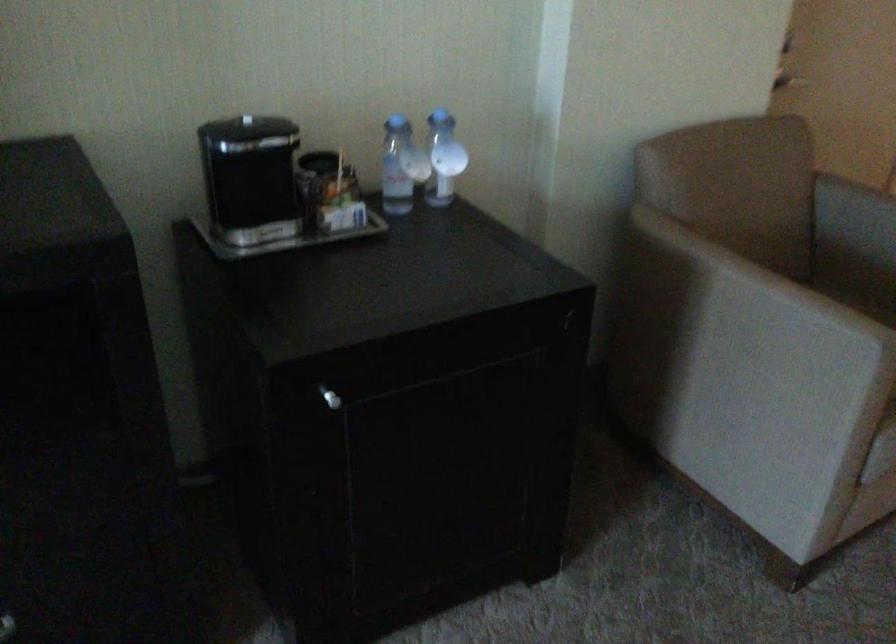
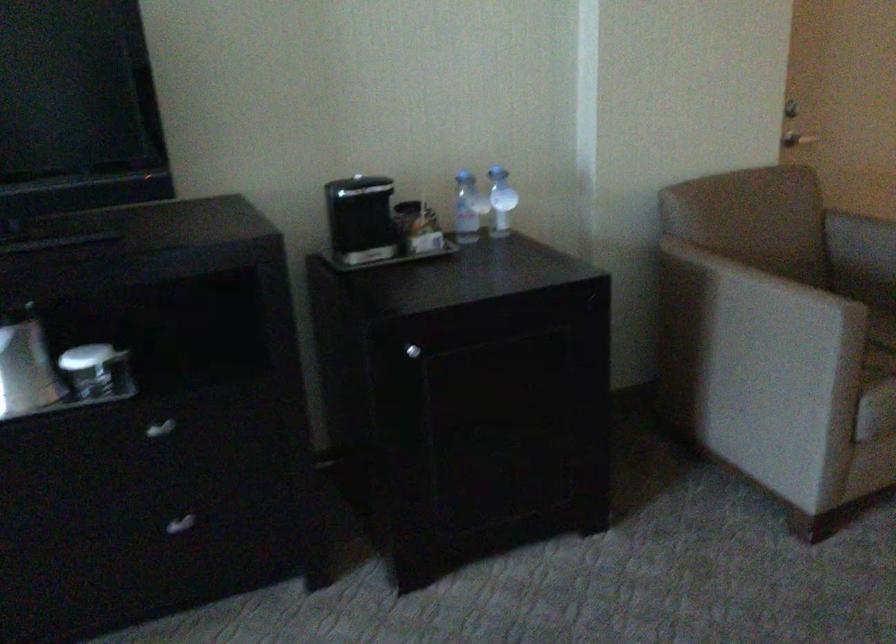
What movement of the cameraman would produce the second image?

The cameraman walked toward right, backward.